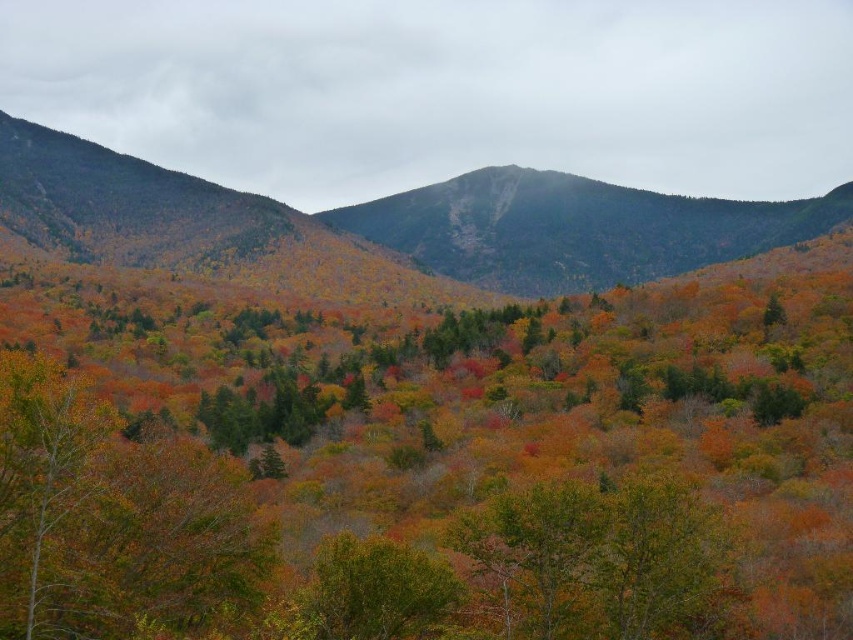
You are a hiker standing at the base of the green textured mountain at center. You want to reach the summit. The trail is marked by a series of markers every 100 feet. How many markers will you pass before reaching the summit?

The green textured mountain at center has a summit that is 1279.71 feet away from the base. Since the markers are placed every 100 feet, you will pass 12 markers before reaching the summit. The calculation is 1279.71 divided by 100, which equals approximately 12.7971. Since you pass a marker at each 100 feet increment, the 12th marker is at 1200 feet, and the remaining 79.71 feet would not reach the 13th marker before the summit.

You are an outdoor enthusiast planning a hiking route through the mountainous landscape. You want to ensure your path takes you past both the green textured mountain at center and the green matte tree at lower left. Given their positions, which object will you encounter first as you begin your hike from the lower left corner of the scene?

The green matte tree at lower left is behind the green textured mountain at center, so you will encounter the green textured mountain at center first before reaching the green matte tree at lower left.

You are standing in the autumn forest and want to locate the green matte tree at lower left. According to the coordinates provided, where should you look relative to your position?

You should look towards the lower left direction to find the green matte tree at lower left, as it is located at point (112,518).